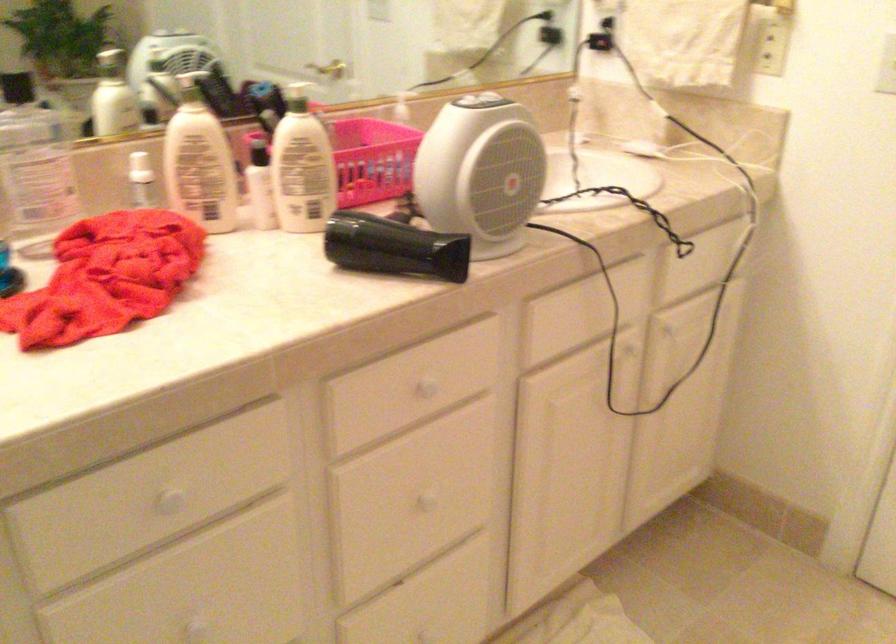
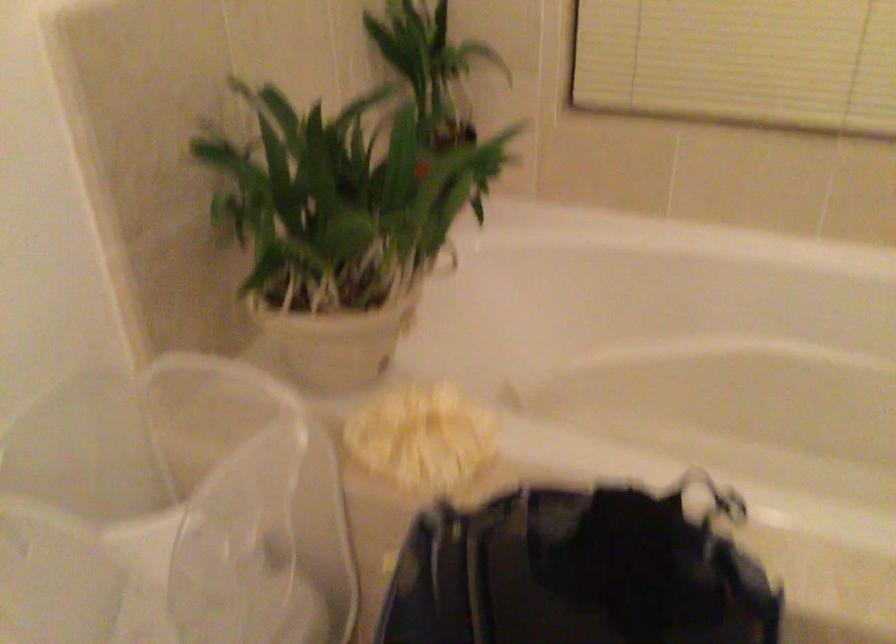
Based on the photo, the images are taken continuously from a first-person perspective. In which direction is your viewpoint rotating?

The rotation direction of the camera is right-down.